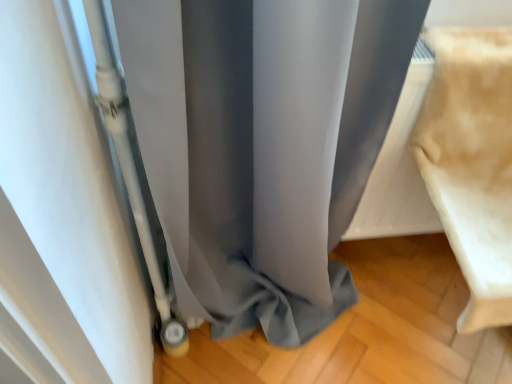
Question: Is beige fabric cushion at right thinner than matte gray curtain at center?

Choices:
 (A) yes
 (B) no

Answer: (B)

Question: Is beige fabric cushion at right behind matte gray curtain at center?

Choices:
 (A) no
 (B) yes

Answer: (B)

Question: Does beige fabric cushion at right have a greater height compared to matte gray curtain at center?

Choices:
 (A) yes
 (B) no

Answer: (B)

Question: Is beige fabric cushion at right oriented away from matte gray curtain at center?

Choices:
 (A) yes
 (B) no

Answer: (B)

Question: Is beige fabric cushion at right placed right next to matte gray curtain at center?

Choices:
 (A) yes
 (B) no

Answer: (B)

Question: Can you confirm if beige fabric cushion at right is bigger than matte gray curtain at center?

Choices:
 (A) yes
 (B) no

Answer: (B)

Question: Can you confirm if matte gray curtain at center is taller than beige fabric cushion at right?

Choices:
 (A) yes
 (B) no

Answer: (A)

Question: Can you confirm if matte gray curtain at center is positioned to the left of beige fabric cushion at right?

Choices:
 (A) yes
 (B) no

Answer: (A)

Question: From a real-world perspective, is matte gray curtain at center on top of beige fabric cushion at right?

Choices:
 (A) yes
 (B) no

Answer: (B)

Question: Is matte gray curtain at center smaller than beige fabric cushion at right?

Choices:
 (A) yes
 (B) no

Answer: (B)

Question: From the image's perspective, is matte gray curtain at center over beige fabric cushion at right?

Choices:
 (A) no
 (B) yes

Answer: (A)

Question: Considering the relative sizes of matte gray curtain at center and beige fabric cushion at right in the image provided, is matte gray curtain at center bigger than beige fabric cushion at right?

Choices:
 (A) yes
 (B) no

Answer: (A)

Question: Looking at the image, does beige fabric cushion at right seem bigger or smaller compared to matte gray curtain at center?

Choices:
 (A) small
 (B) big

Answer: (A)